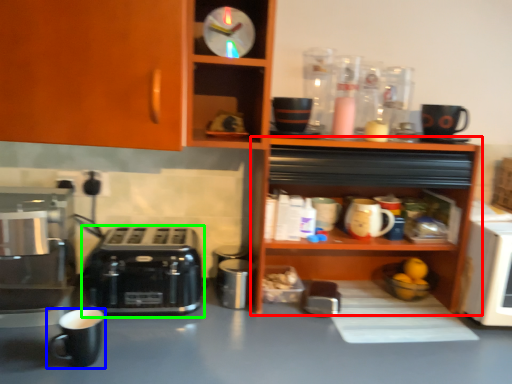
Question: Considering the real-world distances, which object is closest to shelf (highlighted by a red box)? coffee cup (highlighted by a blue box) or toaster (highlighted by a green box).

Choices:
 (A) coffee cup
 (B) toaster

Answer: (B)